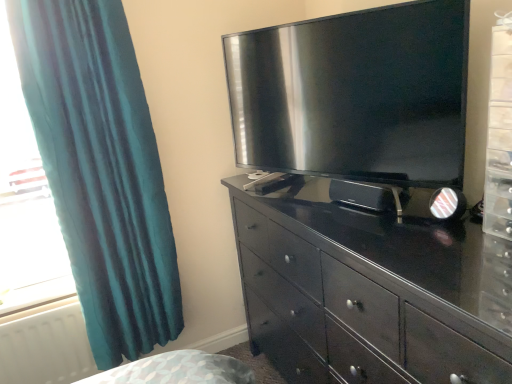
Question: Considering the relative sizes of white matte radiator at lower left and black glossy television at upper center in the image provided, is white matte radiator at lower left wider than black glossy television at upper center?

Choices:
 (A) no
 (B) yes

Answer: (A)

Question: From the image's perspective, is white matte radiator at lower left on top of black glossy television at upper center?

Choices:
 (A) yes
 (B) no

Answer: (B)

Question: From a real-world perspective, is white matte radiator at lower left under black glossy television at upper center?

Choices:
 (A) no
 (B) yes

Answer: (B)

Question: Is white matte radiator at lower left at the right side of black glossy television at upper center?

Choices:
 (A) yes
 (B) no

Answer: (B)

Question: Is the position of white matte radiator at lower left less distant than that of black glossy television at upper center?

Choices:
 (A) yes
 (B) no

Answer: (B)

Question: In terms of height, does teal fabric curtain at left look taller or shorter compared to glossy dark wood chest of drawers at center?

Choices:
 (A) short
 (B) tall

Answer: (B)

Question: Is teal fabric curtain at left wider or thinner than glossy dark wood chest of drawers at center?

Choices:
 (A) thin
 (B) wide

Answer: (A)

Question: From a real-world perspective, is teal fabric curtain at left above or below glossy dark wood chest of drawers at center?

Choices:
 (A) below
 (B) above

Answer: (B)

Question: Relative to glossy dark wood chest of drawers at center, is teal fabric curtain at left in front or behind?

Choices:
 (A) front
 (B) behind

Answer: (B)

Question: From the image's perspective, is teal fabric curtain at left above or below white matte radiator at lower left?

Choices:
 (A) above
 (B) below

Answer: (A)

Question: Choose the correct answer: Is teal fabric curtain at left inside white matte radiator at lower left or outside it?

Choices:
 (A) outside
 (B) inside

Answer: (A)

Question: Considering the positions of teal fabric curtain at left and white matte radiator at lower left in the image, is teal fabric curtain at left wider or thinner than white matte radiator at lower left?

Choices:
 (A) wide
 (B) thin

Answer: (A)

Question: Considering the positions of teal fabric curtain at left and white matte radiator at lower left in the image, is teal fabric curtain at left taller or shorter than white matte radiator at lower left?

Choices:
 (A) short
 (B) tall

Answer: (B)

Question: Considering the positions of glossy dark wood chest of drawers at center and white matte radiator at lower left in the image, is glossy dark wood chest of drawers at center bigger or smaller than white matte radiator at lower left?

Choices:
 (A) small
 (B) big

Answer: (B)

Question: Is glossy dark wood chest of drawers at center to the left or to the right of white matte radiator at lower left in the image?

Choices:
 (A) left
 (B) right

Answer: (B)